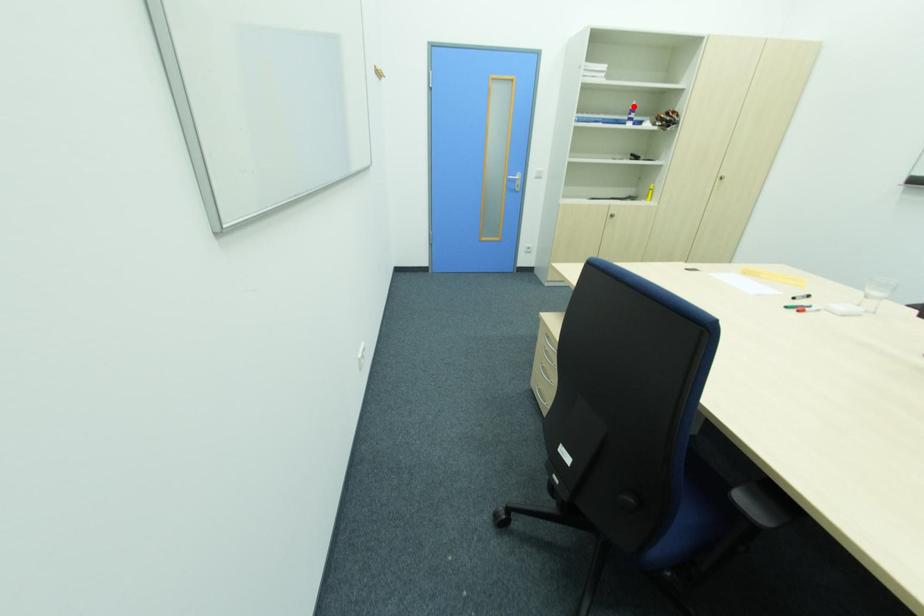
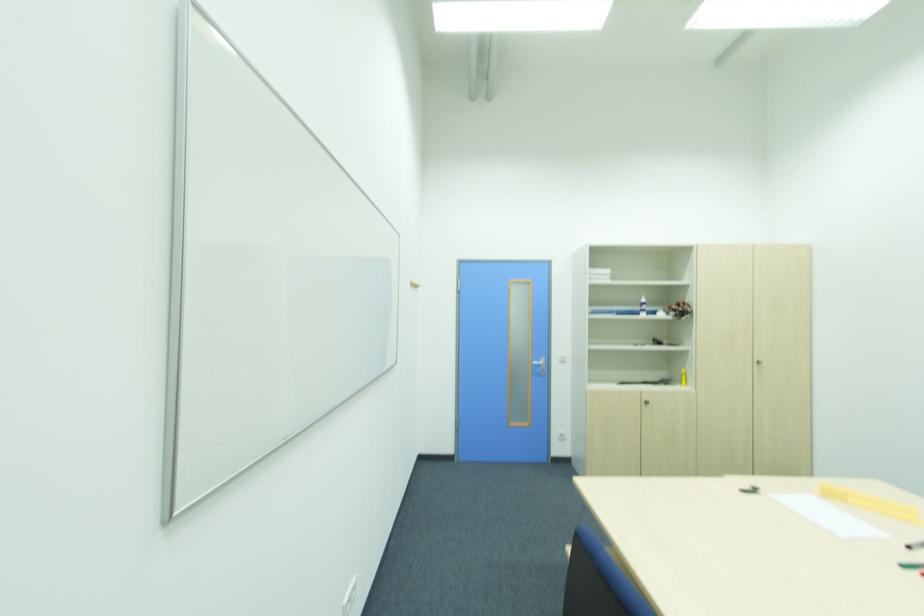
Locate, in the second image, the point that corresponds to the highlighted location in the first image.

(643, 301)